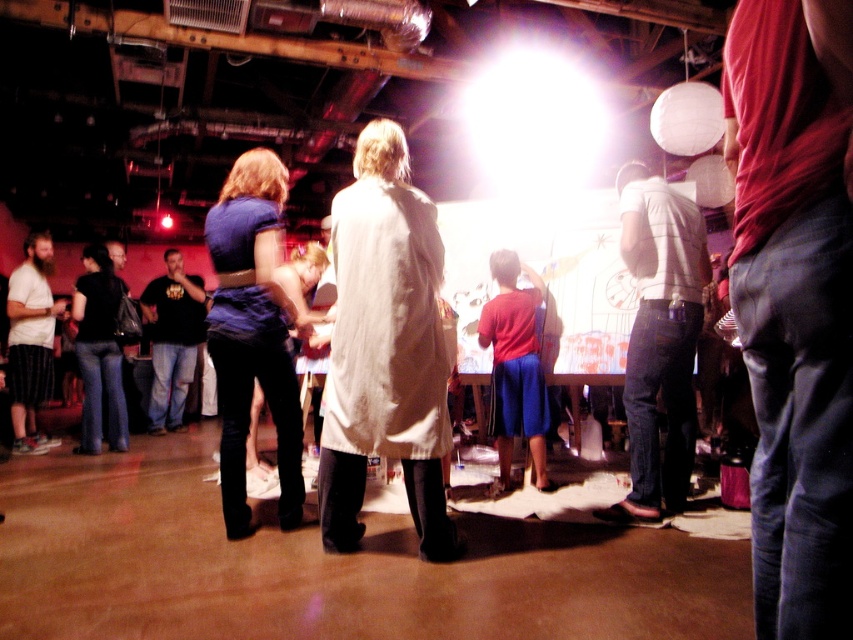
You are standing at the entrance of the room and see two points marked on the wall. The first point is at coordinates point (422,259) and the second point is at point (693,417). Which point is closer to you?

Point (422,259) is in front of point (693,417), so it is closer to you.

You are standing in the room and see two people working on the canvas. The person wearing the white textured shirt at center and the one in the black cotton shirt at left. Which shirt is more to the right?

The white textured shirt at center is positioned on the right side of black cotton shirt at left, so the white textured shirt at center is more to the right.